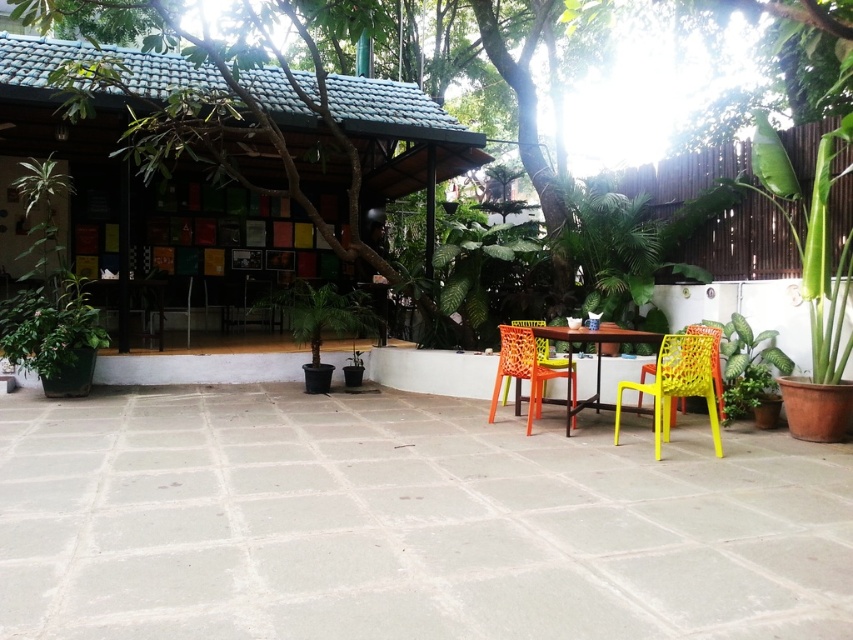
Question: Can you confirm if smooth concrete patio at center is thinner than orange mesh chair at center?

Choices:
 (A) yes
 (B) no

Answer: (B)

Question: Observing the image, what is the correct spatial positioning of yellow mesh chair at lower right in reference to metallic yellow table at center?

Choices:
 (A) above
 (B) below

Answer: (B)

Question: Considering the relative positions of smooth concrete patio at center and metallic yellow table at center in the image provided, where is smooth concrete patio at center located with respect to metallic yellow table at center?

Choices:
 (A) right
 (B) left

Answer: (B)

Question: Which object is positioned closest to the yellow mesh chair at lower right?

Choices:
 (A) wooden hut at upper left
 (B) orange mesh chair at center
 (C) metallic yellow table at center

Answer: (C)

Question: Which point appears closest to the camera in this image?

Choices:
 (A) (71, 484)
 (B) (677, 378)

Answer: (A)

Question: Which point is farther to the camera?

Choices:
 (A) (524, 353)
 (B) (161, 314)
 (C) (387, 630)
 (D) (132, 90)

Answer: (B)